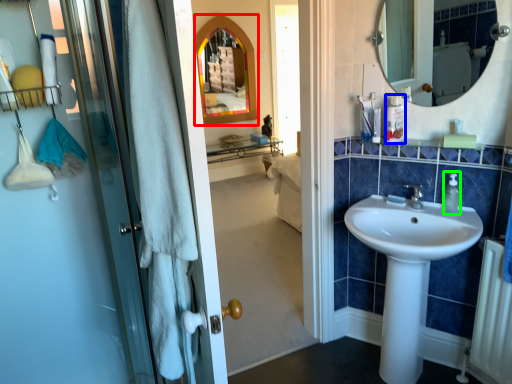
Question: Based on their relative distances, which object is nearer to medicine cabinet (highlighted by a red box)? Choose from toiletry (highlighted by a blue box) and soap dispenser (highlighted by a green box).

Choices:
 (A) toiletry
 (B) soap dispenser

Answer: (A)